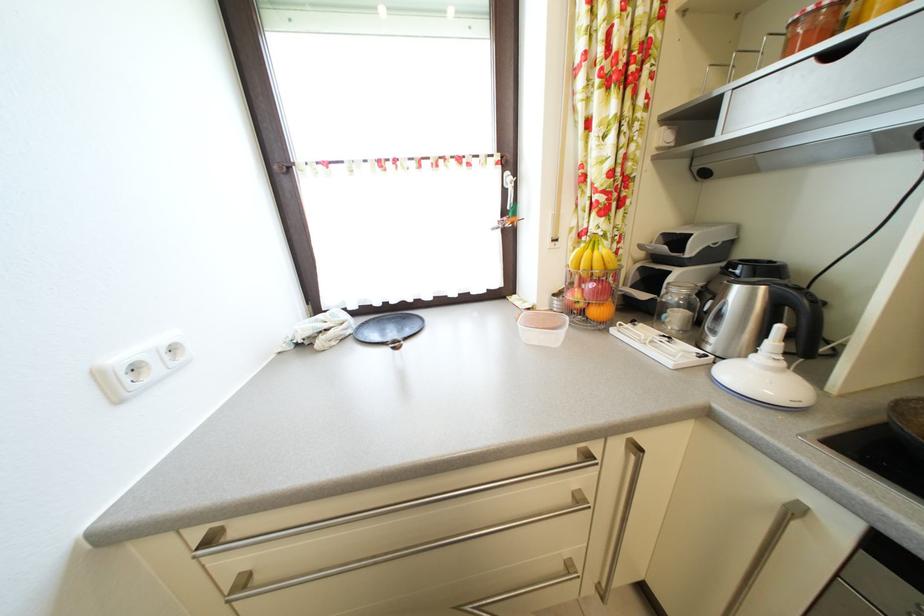
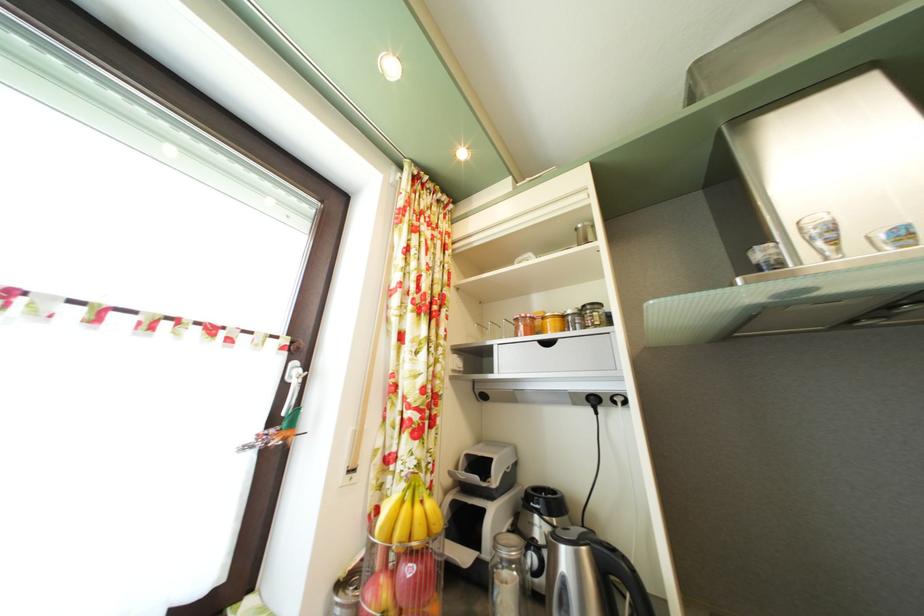
Find the pixel in the second image that matches [600,293] in the first image.

(418, 578)